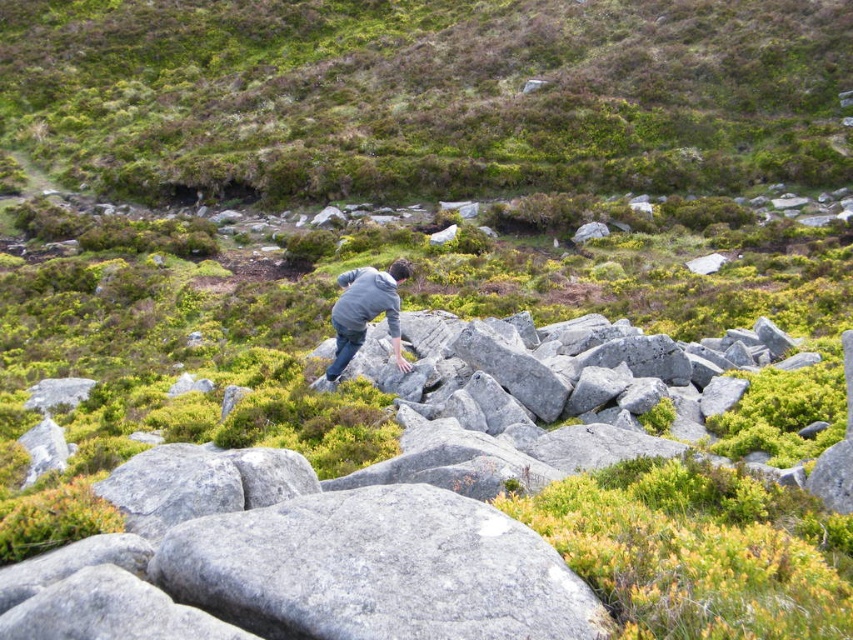
Question: Is green mossy hillside at upper center wider than gray granite rock at center?

Choices:
 (A) yes
 (B) no

Answer: (A)

Question: Estimate the real-world distances between objects in this image. Which object is farther from the gray granite rock at center?

Choices:
 (A) gray matte jacket at center
 (B) green mossy hillside at upper center

Answer: (B)

Question: Among these points, which one is farthest from the camera?

Choices:
 (A) (340, 276)
 (B) (380, 531)
 (C) (781, 72)

Answer: (C)

Question: Is the position of green mossy hillside at upper center more distant than that of gray granite rock at center?

Choices:
 (A) yes
 (B) no

Answer: (A)

Question: Which point is farther to the camera?

Choices:
 (A) (476, 113)
 (B) (421, 580)
 (C) (335, 372)

Answer: (A)

Question: Does green mossy hillside at upper center appear on the right side of gray granite rock at center?

Choices:
 (A) no
 (B) yes

Answer: (A)